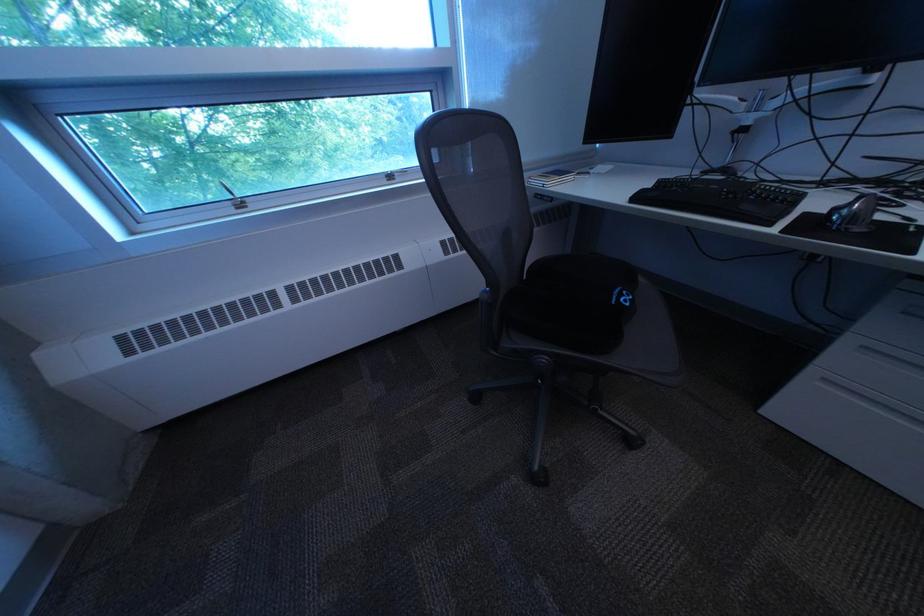
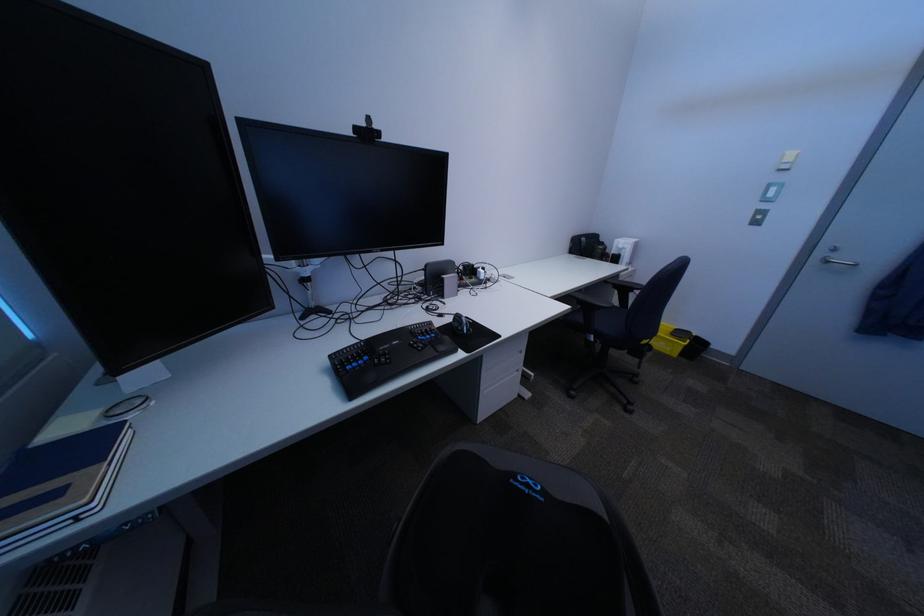
In the second image, find the point that corresponds to point (629, 302) in the first image.

(554, 499)